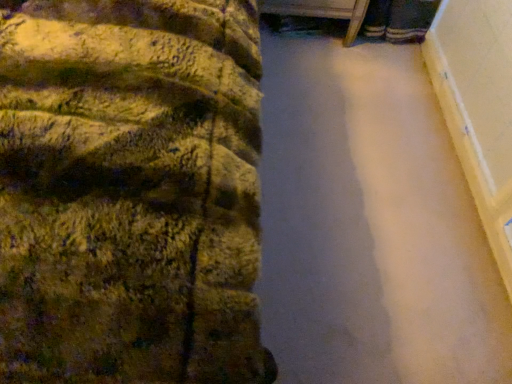
You are a GUI agent. You are given a task and a screenshot of the screen. Output one action in this format:
    pyautogui.click(x=<x>, y=<y>)
    Task: Click on the vacant area that is in front of wooden chair at upper center
    This screenshot has width=512, height=384.
    Given the screenshot: What is the action you would take?
    316,79